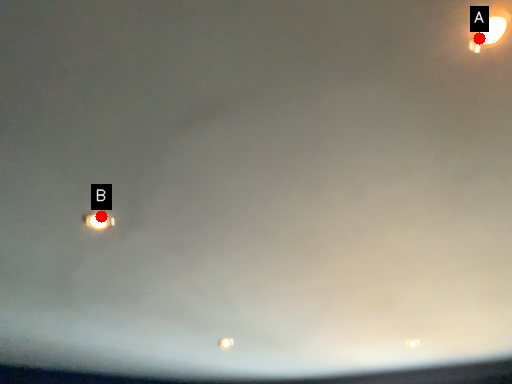
Question: Two points are circled on the image, labeled by A and B beside each circle. Which point is farther to the camera?

Choices:
 (A) A is further
 (B) B is further

Answer: (B)